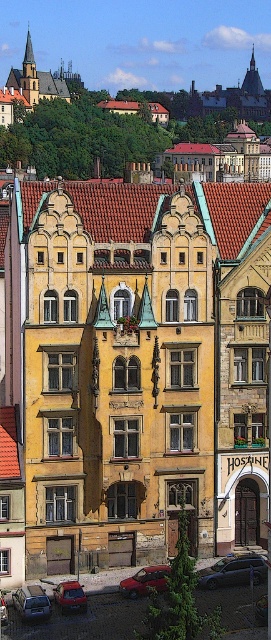
Question: Among these points, which one is nearest to the camera?

Choices:
 (A) (115, 145)
 (B) (240, 564)

Answer: (B)

Question: Considering the relative positions of metallic silver car at lower left and metallic red car at lower center in the image provided, where is metallic silver car at lower left located with respect to metallic red car at lower center?

Choices:
 (A) above
 (B) below

Answer: (B)

Question: Which of these objects is positioned farthest from the metallic silver car at lower left?

Choices:
 (A) metallic red car at lower left
 (B) metallic red car at center
 (C) metallic red car at lower center
 (D) metallic gray car at lower center

Answer: (D)

Question: Does yellow stone building at center have a larger size compared to metallic silver car at lower left?

Choices:
 (A) yes
 (B) no

Answer: (A)

Question: Among these objects, which one is nearest to the camera?

Choices:
 (A) metallic red car at lower center
 (B) metallic gray car at lower center
 (C) yellow stone building at center
 (D) metallic red car at lower left

Answer: (D)

Question: Can you confirm if yellow stone building at center is positioned to the right of metallic red car at lower left?

Choices:
 (A) no
 (B) yes

Answer: (A)